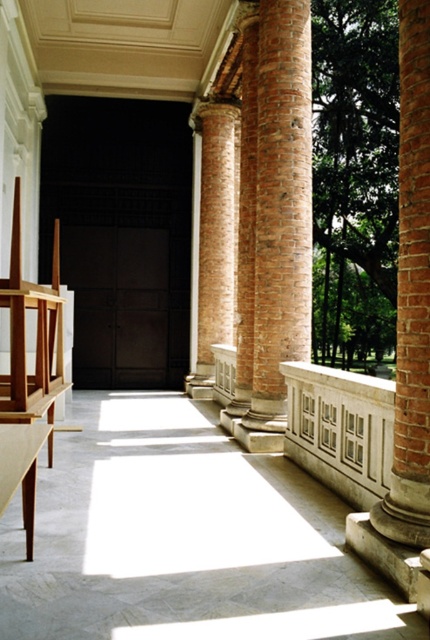
Question: Can you confirm if brick column at right is positioned above white stone balustrade at center?

Choices:
 (A) no
 (B) yes

Answer: (B)

Question: Which point is farther from the camera taking this photo?

Choices:
 (A) (306, 435)
 (B) (279, 218)
 (C) (429, 292)
 (D) (217, 152)

Answer: (D)

Question: Which point is closer to the camera?

Choices:
 (A) (322, 442)
 (B) (196, 310)

Answer: (A)

Question: Which of the following is the farthest from the observer?

Choices:
 (A) brick column at right
 (B) white stone balustrade at center
 (C) brown textured column at center

Answer: (C)

Question: Is brown textured column at center to the left of white stone balustrade at center from the viewer's perspective?

Choices:
 (A) no
 (B) yes

Answer: (B)

Question: Does brown textured column at center appear over brick column at right?

Choices:
 (A) yes
 (B) no

Answer: (A)